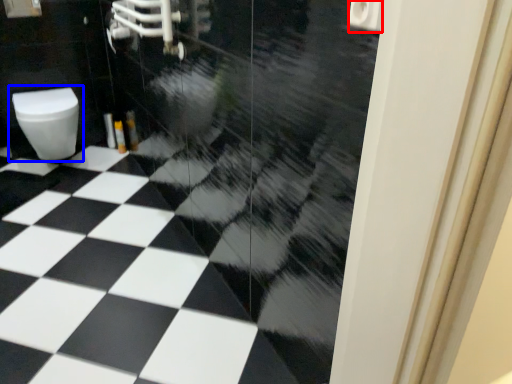
Question: Which of the following is the closest to the observer, toilet paper (highlighted by a red box) or toilet (highlighted by a blue box)?

Choices:
 (A) toilet paper
 (B) toilet

Answer: (A)